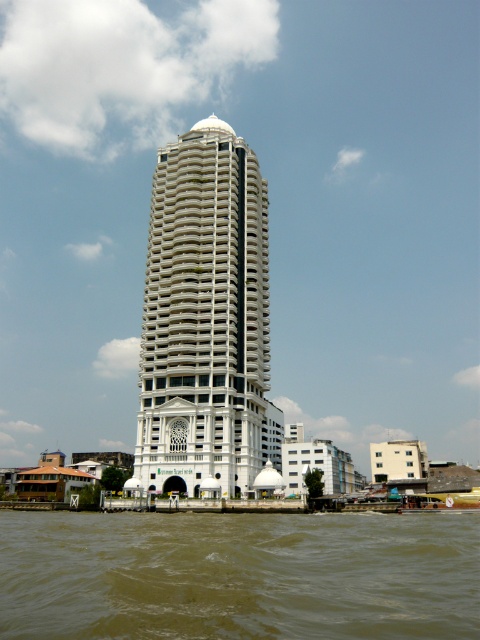
Question: Which of these objects is positioned farthest from the white glossy building at center?

Choices:
 (A) white matte building at lower right
 (B) white glossy building at lower center

Answer: (A)

Question: Which point is closer to the camera taking this photo?

Choices:
 (A) (290, 464)
 (B) (371, 454)
 (C) (228, 273)
 (D) (295, 540)

Answer: (D)

Question: Does brown muddy water at lower center have a larger size compared to white matte building at lower right?

Choices:
 (A) yes
 (B) no

Answer: (B)

Question: Is white glossy building at center wider than white glossy building at lower center?

Choices:
 (A) yes
 (B) no

Answer: (B)

Question: Is white glossy building at center to the right of white glossy building at lower center from the viewer's perspective?

Choices:
 (A) yes
 (B) no

Answer: (B)

Question: Which of the following is the farthest from the observer?

Choices:
 (A) white glossy building at center
 (B) white matte building at lower right
 (C) brown muddy water at lower center

Answer: (B)